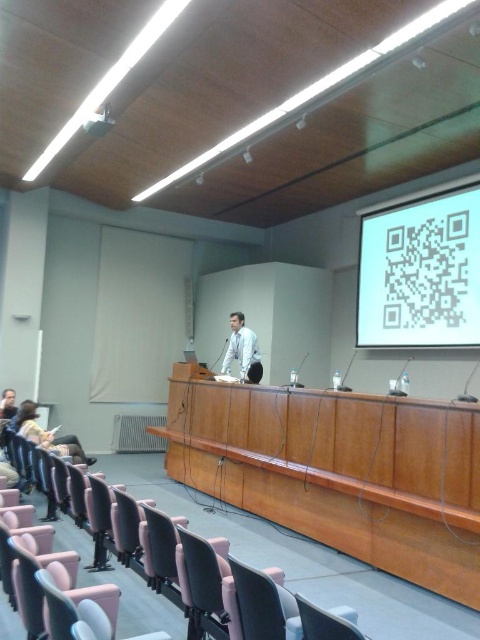
Question: Which of the following is the closest to the observer?

Choices:
 (A) light brown leather jacket at lower left
 (B) light brown leather chair at lower left
 (C) white glossy shirt at center
 (D) dark brown hair at lower left

Answer: (B)

Question: Based on their relative distances, which object is nearer to the white glossy projector at upper center?

Choices:
 (A) matte pink plastic chair at lower center
 (B) matte black chair at lower left

Answer: (B)

Question: Which point is closer to the camera?

Choices:
 (A) light brown leather jacket at lower left
 (B) white matte qr code at upper right
 (C) matte pink chair at lower left

Answer: (C)

Question: Can you confirm if matte black chair at lower left is wider than dark brown hair at lower left?

Choices:
 (A) yes
 (B) no

Answer: (B)

Question: Can you confirm if matte pink chair at lower left is positioned to the right of dark brown hair at lower left?

Choices:
 (A) yes
 (B) no

Answer: (A)

Question: Is light brown leather jacket at lower left closer to camera compared to dark brown hair at lower left?

Choices:
 (A) yes
 (B) no

Answer: (A)